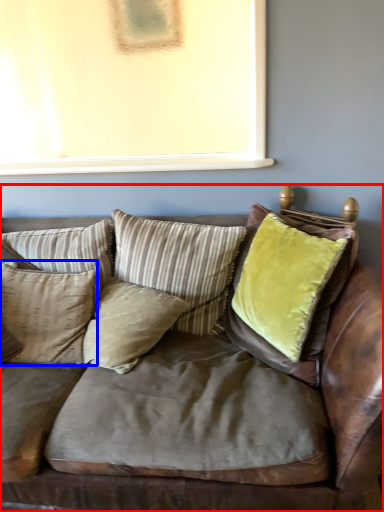
Question: Which object appears farthest to the camera in this image, studio couch (highlighted by a red box) or pillow (highlighted by a blue box)?

Choices:
 (A) studio couch
 (B) pillow

Answer: (B)